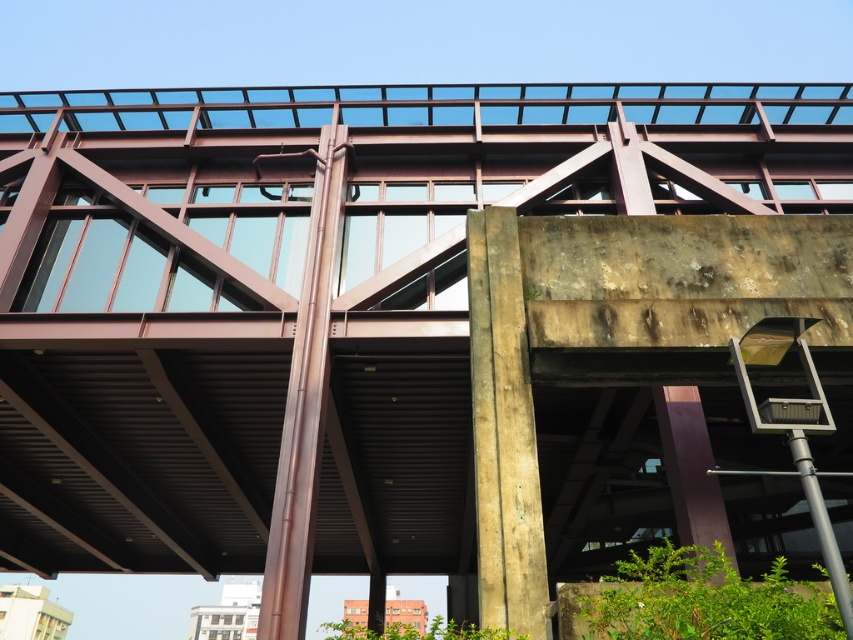
Is concrete textured pillar at center below brown metallic pipe at center?

Correct, concrete textured pillar at center is located below brown metallic pipe at center.

Which is behind, point (512, 433) or point (311, 234)?

Positioned behind is point (311, 234).

Identify the location of concrete textured pillar at center. (503, 432).

Describe the element at coordinates (305, 400) in the screenshot. I see `brown metallic pipe at center` at that location.

This screenshot has width=853, height=640. What are the coordinates of `brown metallic pipe at center` in the screenshot? It's located at (305, 400).

At what (x,y) coordinates should I click in order to perform the action: click on brown metallic pipe at center. Please return your answer as a coordinate pair (x, y). This screenshot has width=853, height=640. Looking at the image, I should click on (305, 400).

Between concrete textured pillar at center and purple glossy pillar at lower right, which one has more height?

Standing taller between the two is concrete textured pillar at center.

Is point (511, 611) less distant than point (695, 442)?

Yes.

I want to click on concrete textured pillar at center, so click(x=503, y=432).